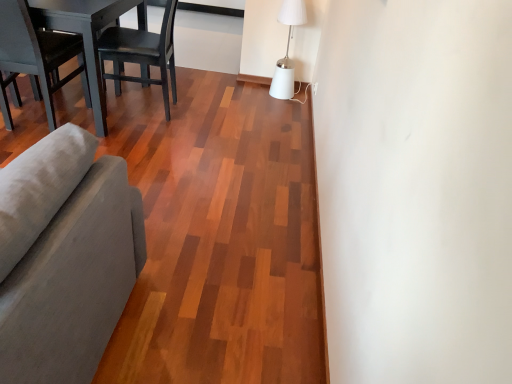
The image size is (512, 384). Describe the element at coordinates (141, 54) in the screenshot. I see `black matte wood chair at upper left, the second chair in the left-to-right sequence` at that location.

The image size is (512, 384). I want to click on black matte wood chair at upper left, the second chair in the left-to-right sequence, so click(141, 54).

Find the location of a particular element. The width and height of the screenshot is (512, 384). dark wood table at left is located at coordinates (87, 35).

Find the location of a particular element. black matte wood chair at upper left, the second chair in the left-to-right sequence is located at coordinates (141, 54).

Are black matte wood chair at upper left, positioned as the first chair in right-to-left order, and dark wood table at left beside each other?

No, black matte wood chair at upper left, positioned as the first chair in right-to-left order, is not making contact with dark wood table at left.

Is black matte wood chair at upper left, the second chair in the left-to-right sequence, to the right of dark wood table at left from the viewer's perspective?

Correct, you'll find black matte wood chair at upper left, the second chair in the left-to-right sequence, to the right of dark wood table at left.

Considering the sizes of black matte wood chair at upper left, positioned as the first chair in right-to-left order, and dark wood table at left in the image, is black matte wood chair at upper left, positioned as the first chair in right-to-left order, taller or shorter than dark wood table at left?

In the image, black matte wood chair at upper left, positioned as the first chair in right-to-left order, appears to be taller than dark wood table at left.

Is dark wood table at left at the back of black matte wood chair at upper left, the second chair in the left-to-right sequence?

No, black matte wood chair at upper left, the second chair in the left-to-right sequence, is not facing away from dark wood table at left.

From a real-world perspective, is matte gray chair at left, the first chair viewed from the left, located beneath black matte wood chair at upper left, positioned as the first chair in right-to-left order?

Incorrect, from a real-world perspective, matte gray chair at left, the first chair viewed from the left, is higher than black matte wood chair at upper left, positioned as the first chair in right-to-left order.

Considering the positions of objects matte gray chair at left, which ranks as the 2th chair in right-to-left order, and black matte wood chair at upper left, the second chair in the left-to-right sequence, in the image provided, who is more to the left, matte gray chair at left, which ranks as the 2th chair in right-to-left order, or black matte wood chair at upper left, the second chair in the left-to-right sequence,?

matte gray chair at left, which ranks as the 2th chair in right-to-left order.

Does matte gray chair at left, which ranks as the 2th chair in right-to-left order, have a larger size compared to black matte wood chair at upper left, positioned as the first chair in right-to-left order?

Incorrect, matte gray chair at left, which ranks as the 2th chair in right-to-left order, is not larger than black matte wood chair at upper left, positioned as the first chair in right-to-left order.

Between white matte table lamp at upper right and matte gray chair at left, the first chair viewed from the left, which one has smaller width?

Thinner between the two is white matte table lamp at upper right.

Is white matte table lamp at upper right not inside matte gray chair at left, which ranks as the 2th chair in right-to-left order?

Yes, white matte table lamp at upper right is outside of matte gray chair at left, which ranks as the 2th chair in right-to-left order.

From the picture: Considering the sizes of objects white matte table lamp at upper right and matte gray chair at left, the first chair viewed from the left, in the image provided, who is shorter, white matte table lamp at upper right or matte gray chair at left, the first chair viewed from the left,?

white matte table lamp at upper right is shorter.

Which object is more forward, white matte table lamp at upper right or matte gray chair at left, which ranks as the 2th chair in right-to-left order?

matte gray chair at left, which ranks as the 2th chair in right-to-left order, is in front.

Can you tell me how much matte gray chair at left, the first chair viewed from the left, and white matte table lamp at upper right differ in facing direction?

90.5 degrees.

Looking at this image, is matte gray chair at left, the first chair viewed from the left, facing towards white matte table lamp at upper right?

No, matte gray chair at left, the first chair viewed from the left, is not oriented towards white matte table lamp at upper right.

From a real-world perspective, is matte gray chair at left, which ranks as the 2th chair in right-to-left order, located higher than white matte table lamp at upper right?

Correct, in the physical world, matte gray chair at left, which ranks as the 2th chair in right-to-left order, is higher than white matte table lamp at upper right.

Would you say matte gray chair at left, the first chair viewed from the left, is to the left or to the right of white matte table lamp at upper right in the picture?

Clearly, matte gray chair at left, the first chair viewed from the left, is on the left of white matte table lamp at upper right in the image.

Does white matte table lamp at upper right contain black matte wood chair at upper left, the second chair in the left-to-right sequence?

No.

Which is closer to the camera, (298, 22) or (100, 66)?

The point (100, 66) is closer.

From a real-world perspective, which is physically below, white matte table lamp at upper right or black matte wood chair at upper left, the second chair in the left-to-right sequence?

From a 3D spatial view, white matte table lamp at upper right is below.

Which of these two, white matte table lamp at upper right or black matte wood chair at upper left, the second chair in the left-to-right sequence, stands taller?

With more height is black matte wood chair at upper left, the second chair in the left-to-right sequence.

Which object is more forward, gray fabric couch at left or black matte wood chair at upper left, positioned as the first chair in right-to-left order?

Positioned in front is gray fabric couch at left.

From the image's perspective, is gray fabric couch at left under black matte wood chair at upper left, positioned as the first chair in right-to-left order?

Yes, from the image's perspective, gray fabric couch at left is below black matte wood chair at upper left, positioned as the first chair in right-to-left order.

Is point (48, 163) positioned behind point (130, 52)?

No, (48, 163) is closer to viewer.

Considering the relative sizes of gray fabric couch at left and black matte wood chair at upper left, positioned as the first chair in right-to-left order, in the image provided, is gray fabric couch at left thinner than black matte wood chair at upper left, positioned as the first chair in right-to-left order,?

Incorrect, the width of gray fabric couch at left is not less than that of black matte wood chair at upper left, positioned as the first chair in right-to-left order.

Does gray fabric couch at left turn towards matte gray chair at left, which ranks as the 2th chair in right-to-left order?

No, gray fabric couch at left is not turned towards matte gray chair at left, which ranks as the 2th chair in right-to-left order.

Is there a large distance between gray fabric couch at left and matte gray chair at left, the first chair viewed from the left?

Yes.

From the image's perspective, which is below, gray fabric couch at left or matte gray chair at left, the first chair viewed from the left?

gray fabric couch at left is shown below in the image.

Is gray fabric couch at left completely or partially outside of matte gray chair at left, which ranks as the 2th chair in right-to-left order?

Yes.

Image resolution: width=512 pixels, height=384 pixels. Identify the location of chair that is on the right side of dark wood table at left. (141, 54).

I want to click on chair in front of the black matte wood chair at upper left, positioned as the first chair in right-to-left order, so click(35, 57).

Considering their positions, is white matte table lamp at upper right positioned closer to dark wood table at left than black matte wood chair at upper left, positioned as the first chair in right-to-left order?

The object closer to dark wood table at left is black matte wood chair at upper left, positioned as the first chair in right-to-left order.

Considering their positions, is gray fabric couch at left positioned further to black matte wood chair at upper left, positioned as the first chair in right-to-left order, than matte gray chair at left, which ranks as the 2th chair in right-to-left order?

gray fabric couch at left.

Considering their positions, is black matte wood chair at upper left, positioned as the first chair in right-to-left order, positioned further to dark wood table at left than white matte table lamp at upper right?

white matte table lamp at upper right.

In the scene shown: Estimate the real-world distances between objects in this image. Which object is further from white matte table lamp at upper right, gray fabric couch at left or black matte wood chair at upper left, positioned as the first chair in right-to-left order?

gray fabric couch at left.

In the scene shown: From the image, which object appears to be nearer to black matte wood chair at upper left, positioned as the first chair in right-to-left order, white matte table lamp at upper right or matte gray chair at left, which ranks as the 2th chair in right-to-left order?

matte gray chair at left, which ranks as the 2th chair in right-to-left order.

Looking at the image, which one is located closer to white matte table lamp at upper right, black matte wood chair at upper left, positioned as the first chair in right-to-left order, or matte gray chair at left, the first chair viewed from the left?

black matte wood chair at upper left, positioned as the first chair in right-to-left order, is positioned closer to the anchor white matte table lamp at upper right.

From the image, which object appears to be farther from dark wood table at left, matte gray chair at left, the first chair viewed from the left, or gray fabric couch at left?

Based on the image, gray fabric couch at left appears to be further to dark wood table at left.

Based on the photo, which object lies further to the anchor point white matte table lamp at upper right, matte gray chair at left, the first chair viewed from the left, or dark wood table at left?

matte gray chair at left, the first chair viewed from the left, lies further to white matte table lamp at upper right than the other object.

This screenshot has width=512, height=384. What are the coordinates of `chair situated between matte gray chair at left, which ranks as the 2th chair in right-to-left order, and white matte table lamp at upper right from left to right` in the screenshot? It's located at (141, 54).

You are a GUI agent. You are given a task and a screenshot of the screen. Output one action in this format:
    pyautogui.click(x=<x>, y=<y>)
    Task: Click on the table between gray fabric couch at left and black matte wood chair at upper left, positioned as the first chair in right-to-left order, from front to back
    Image resolution: width=512 pixels, height=384 pixels.
    Given the screenshot: What is the action you would take?
    pyautogui.click(x=87, y=35)

Where is `chair positioned between gray fabric couch at left and black matte wood chair at upper left, the second chair in the left-to-right sequence, from near to far`? chair positioned between gray fabric couch at left and black matte wood chair at upper left, the second chair in the left-to-right sequence, from near to far is located at coordinates (35, 57).

Find the location of a particular element. The height and width of the screenshot is (384, 512). chair between dark wood table at left and white matte table lamp at upper right is located at coordinates (141, 54).